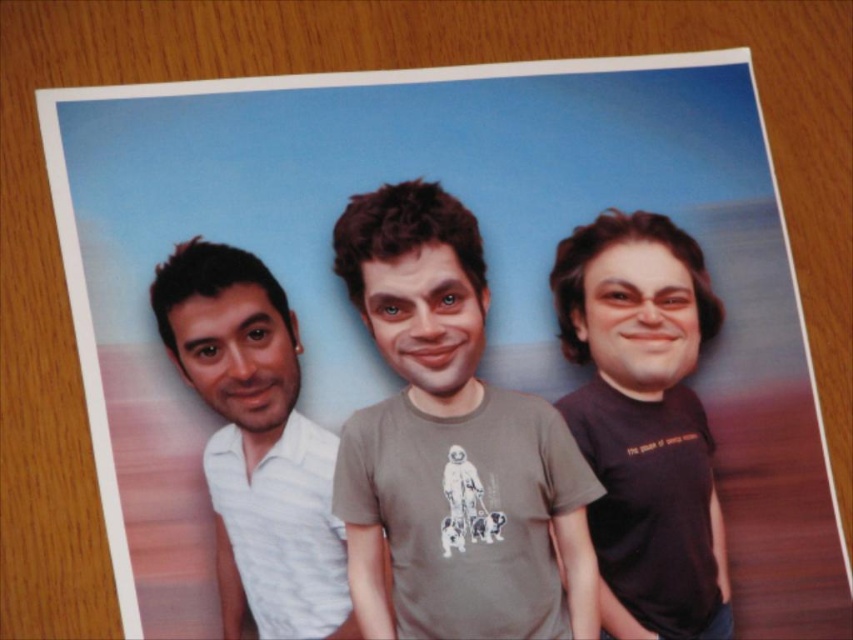
Question: Does black matte t-shirt at right appear on the right side of white textured shirt at left?

Choices:
 (A) no
 (B) yes

Answer: (B)

Question: Among these points, which one is farthest from the camera?

Choices:
 (A) (364, 513)
 (B) (665, 465)

Answer: (B)

Question: Which of the following is the farthest from the observer?

Choices:
 (A) (280, 342)
 (B) (679, 500)

Answer: (B)

Question: Is black matte t-shirt at right positioned before white textured shirt at left?

Choices:
 (A) yes
 (B) no

Answer: (B)

Question: Which point is farther from the camera taking this photo?

Choices:
 (A) (445, 518)
 (B) (648, 605)
 (C) (294, 589)

Answer: (B)

Question: Is gray cotton t-shirt at center positioned before black matte t-shirt at right?

Choices:
 (A) yes
 (B) no

Answer: (A)